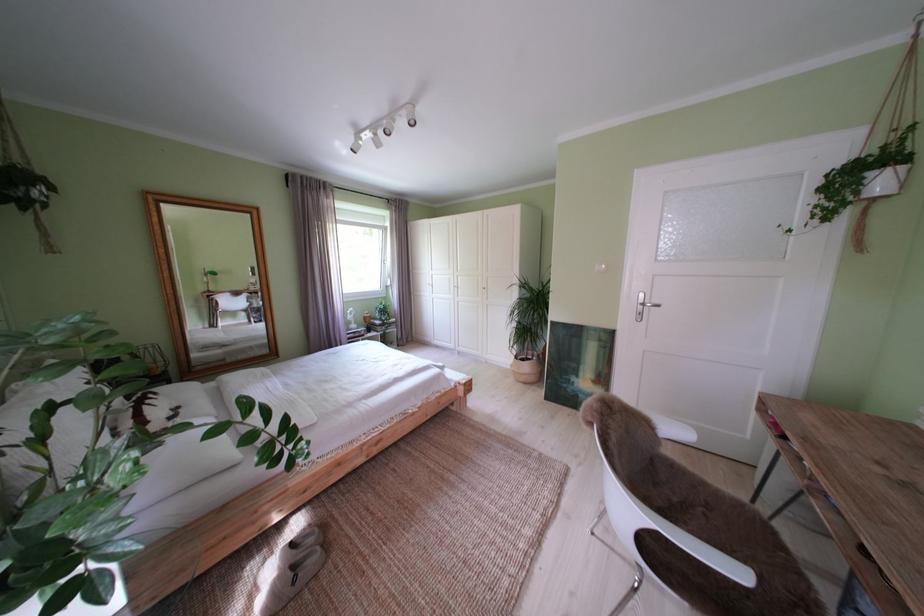
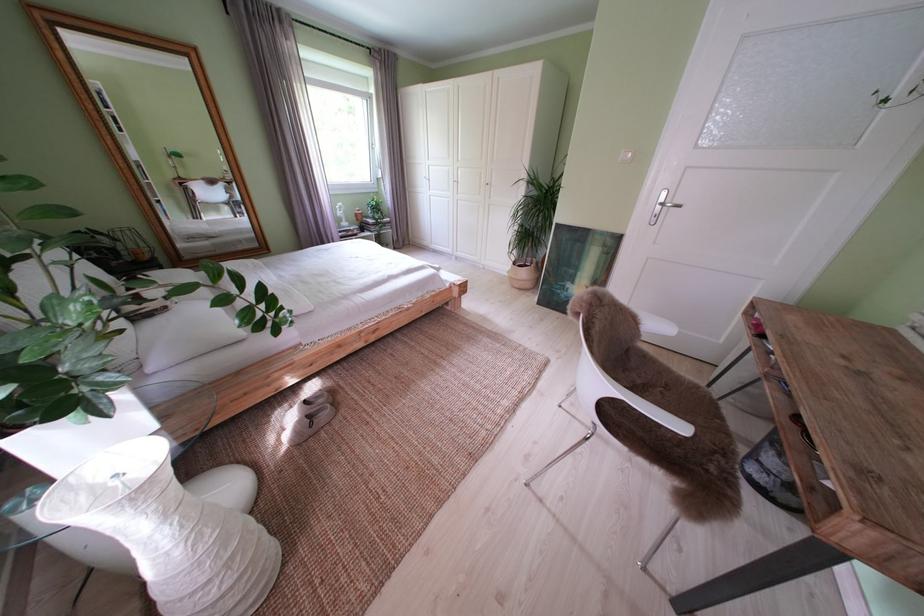
Question: Based on the continuous images, in which direction is the camera rotating? Reply with the corresponding letter.

Choices:
 (A) Left
 (B) Right
 (C) Up
 (D) Down

Answer: (D)